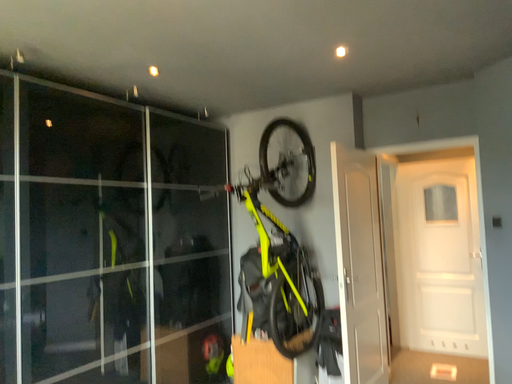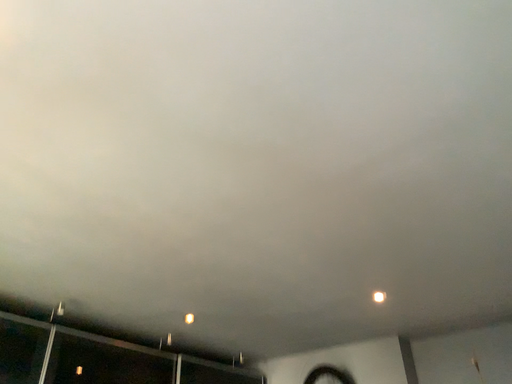
Question: How did the camera likely rotate when shooting the video?

Choices:
 (A) rotated upward
 (B) rotated downward

Answer: (A)